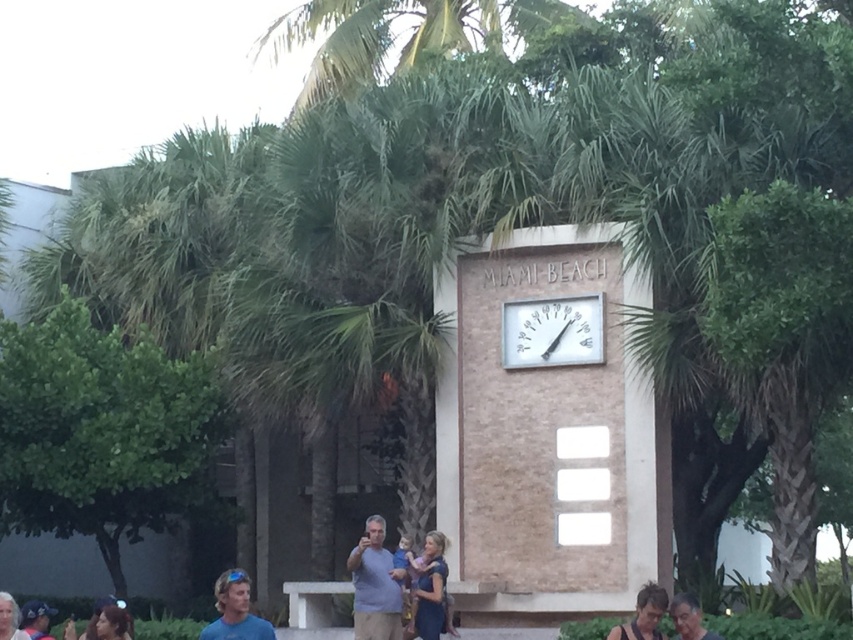
Is blue matte shirt at lower left thinner than dark brown hair at lower left?

Incorrect, blue matte shirt at lower left's width is not less than dark brown hair at lower left's.

Is blue matte shirt at lower left bigger than dark brown hair at lower left?

Yes.

Does point (245, 614) come farther from viewer compared to point (115, 636)?

That is False.

At what (x,y) coordinates should I click in order to perform the action: click on blue matte shirt at lower left. Please return your answer as a coordinate pair (x, y). The width and height of the screenshot is (853, 640). Looking at the image, I should click on (235, 611).

Between blue denim dress at center and smooth skin face at lower right, which one has less height?

smooth skin face at lower right

Describe the element at coordinates (430, 592) in the screenshot. Image resolution: width=853 pixels, height=640 pixels. I see `blue denim dress at center` at that location.

Does point (421, 625) lie in front of point (676, 637)?

No.

The image size is (853, 640). I want to click on blue denim dress at center, so click(x=430, y=592).

What do you see at coordinates (102, 432) in the screenshot?
I see `green leafy tree at left` at bounding box center [102, 432].

Does green leafy tree at left lie behind blonde hair at lower left?

That is True.

Does point (91, 326) lie behind point (3, 632)?

That is True.

Locate an element on the screen. This screenshot has height=640, width=853. green leafy tree at left is located at coordinates (102, 432).